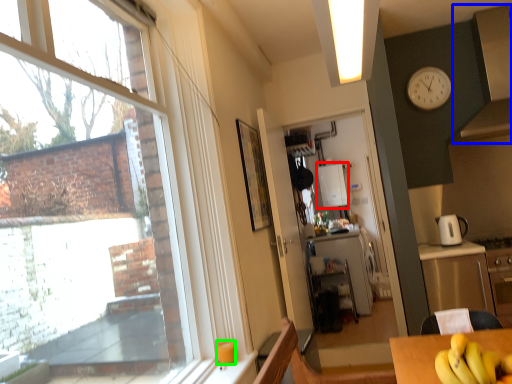
Question: Which is farther away from appliance (highlighted by a red box)? exhaust hood (highlighted by a blue box) or coffee cup (highlighted by a green box)?

Choices:
 (A) exhaust hood
 (B) coffee cup

Answer: (B)